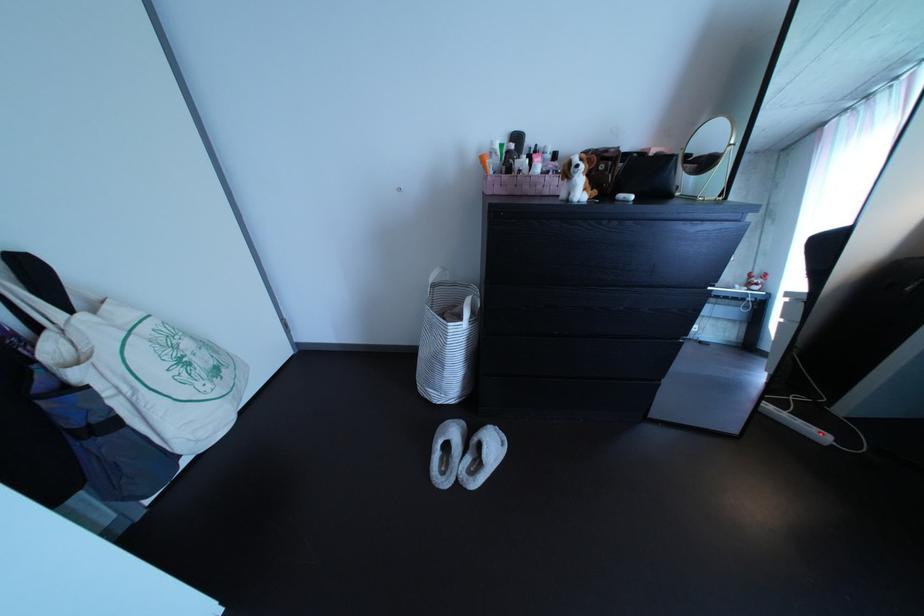
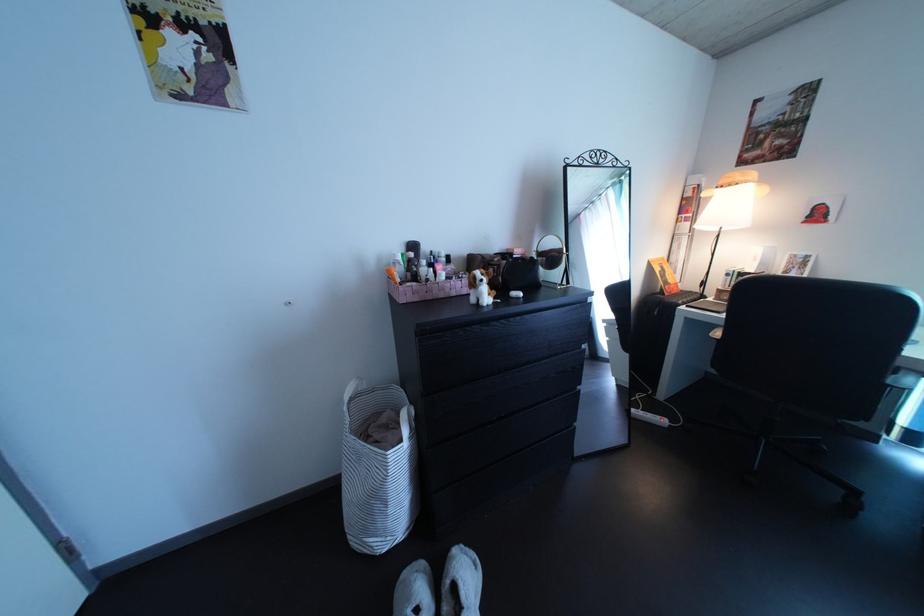
The point at (560, 180) is marked in the first image. Where is the corresponding point in the second image?

(464, 286)